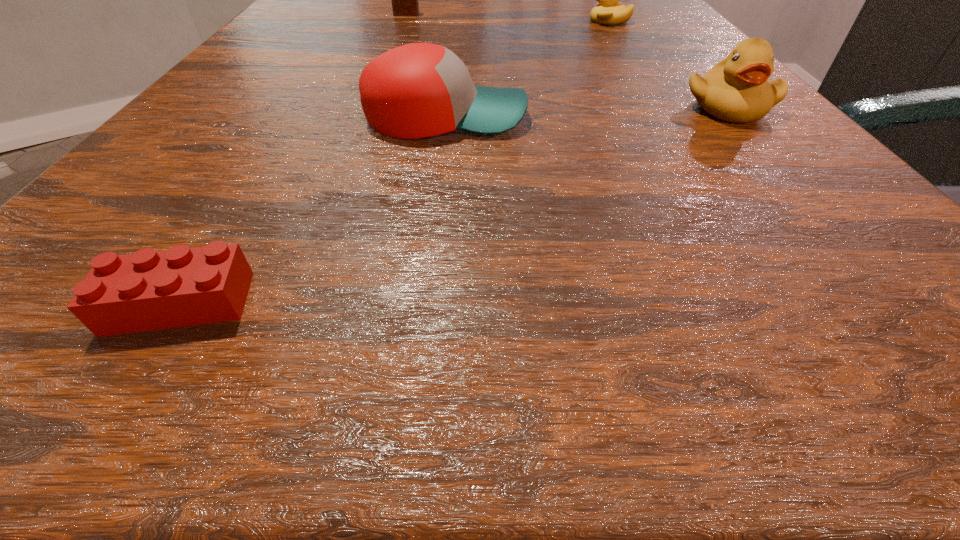
What are the coordinates of `unoccupied area between the baseball cap and the taller duckling` in the screenshot? It's located at (587, 112).

At what (x,y) coordinates should I click in order to perform the action: click on free space that is in between the taller duckling and the padlock. Please return your answer as a coordinate pair (x, y). The width and height of the screenshot is (960, 540). Looking at the image, I should click on (566, 61).

Where is `free space between the leftmost object and the padlock`? The width and height of the screenshot is (960, 540). free space between the leftmost object and the padlock is located at coordinates (294, 159).

This screenshot has height=540, width=960. What are the coordinates of `vacant space that is in between the padlock and the taller duckling` in the screenshot? It's located at (566, 61).

At what (x,y) coordinates should I click in order to perform the action: click on free spot between the nearer duckling and the baseball cap. Please return your answer as a coordinate pair (x, y). The height and width of the screenshot is (540, 960). Looking at the image, I should click on (587, 112).

I want to click on blank region between the fourth tallest object and the taller duckling, so click(668, 64).

Where is `object that ranks as the fourth closest to the shorter duckling`? The height and width of the screenshot is (540, 960). object that ranks as the fourth closest to the shorter duckling is located at coordinates (149, 290).

You are a GUI agent. You are given a task and a screenshot of the screen. Output one action in this format:
    pyautogui.click(x=<x>, y=<y>)
    Task: Click on the closest object to the nearer duckling
    This screenshot has height=540, width=960.
    Given the screenshot: What is the action you would take?
    pyautogui.click(x=418, y=90)